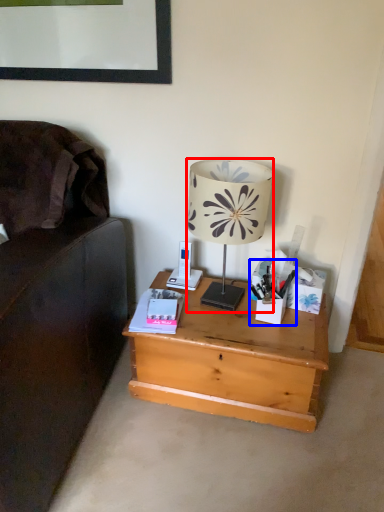
Question: Which object appears farthest to the camera in this image, lamp (highlighted by a red box) or stationery (highlighted by a blue box)?

Choices:
 (A) lamp
 (B) stationery

Answer: (B)